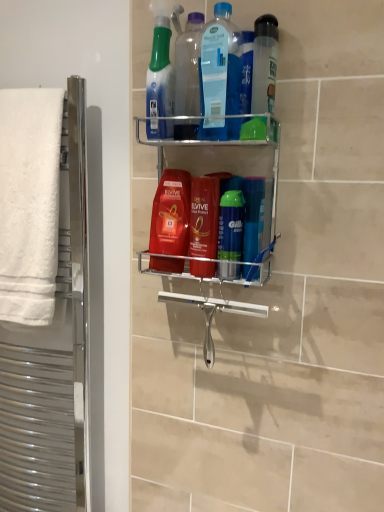
Question: From a real-world perspective, is red glossy mouthwash at center, the 4th mouthwash in the right-to-left sequence, positioned over transparent plastic bottle at upper center based on gravity?

Choices:
 (A) no
 (B) yes

Answer: (A)

Question: From a real-world perspective, is red glossy mouthwash at center, the 4th mouthwash in the right-to-left sequence, beneath transparent plastic bottle at upper center?

Choices:
 (A) yes
 (B) no

Answer: (A)

Question: Is red glossy mouthwash at center, the 1th mouthwash viewed from the left, positioned with its back to transparent plastic bottle at upper center?

Choices:
 (A) yes
 (B) no

Answer: (B)

Question: Would you say red glossy mouthwash at center, the 4th mouthwash in the right-to-left sequence, is outside transparent plastic bottle at upper center?

Choices:
 (A) yes
 (B) no

Answer: (A)

Question: From a real-world perspective, relative to blue translucent bottle at upper center, arranged as the second cleaning product when viewed from the top, is clear plastic bottle at upper center, the fourth mouthwash from the left, vertically above or below?

Choices:
 (A) above
 (B) below

Answer: (B)

Question: Would you say clear plastic bottle at upper center, the fourth mouthwash from the left, is to the left or to the right of blue translucent bottle at upper center, placed as the second cleaning product when sorted from bottom to top, in the picture?

Choices:
 (A) left
 (B) right

Answer: (B)

Question: Considering the positions of clear plastic bottle at upper center, the fourth mouthwash from the left, and blue translucent bottle at upper center, arranged as the second cleaning product when viewed from the top, in the image, is clear plastic bottle at upper center, the fourth mouthwash from the left, wider or thinner than blue translucent bottle at upper center, arranged as the second cleaning product when viewed from the top,?

Choices:
 (A) wide
 (B) thin

Answer: (A)

Question: Is clear plastic bottle at upper center, the 1th mouthwash from the right, inside the boundaries of blue translucent bottle at upper center, placed as the second cleaning product when sorted from bottom to top, or outside?

Choices:
 (A) outside
 (B) inside

Answer: (A)

Question: Is translucent plastic spray bottle at upper center, the 3th cleaning product in the bottom-to-top sequence, inside the boundaries of red glossy mouthwash at center, the 1th mouthwash viewed from the left, or outside?

Choices:
 (A) inside
 (B) outside

Answer: (B)

Question: Looking at their shapes, would you say translucent plastic spray bottle at upper center, the 3th cleaning product in the bottom-to-top sequence, is wider or thinner than red glossy mouthwash at center, the 4th mouthwash in the right-to-left sequence?

Choices:
 (A) thin
 (B) wide

Answer: (B)

Question: From the image's perspective, is translucent plastic spray bottle at upper center, the first cleaning product from the top, positioned above or below red glossy mouthwash at center, the 1th mouthwash viewed from the left?

Choices:
 (A) above
 (B) below

Answer: (A)

Question: Would you say translucent plastic spray bottle at upper center, the first cleaning product from the top, is to the left or to the right of red glossy mouthwash at center, the 4th mouthwash in the right-to-left sequence, in the picture?

Choices:
 (A) left
 (B) right

Answer: (A)

Question: In terms of height, does translucent plastic spray bottle at upper center, the 3th cleaning product in the bottom-to-top sequence, look taller or shorter compared to transparent plastic bottle at upper center?

Choices:
 (A) tall
 (B) short

Answer: (A)

Question: From a real-world perspective, is translucent plastic spray bottle at upper center, the first cleaning product from the top, above or below transparent plastic bottle at upper center?

Choices:
 (A) below
 (B) above

Answer: (B)